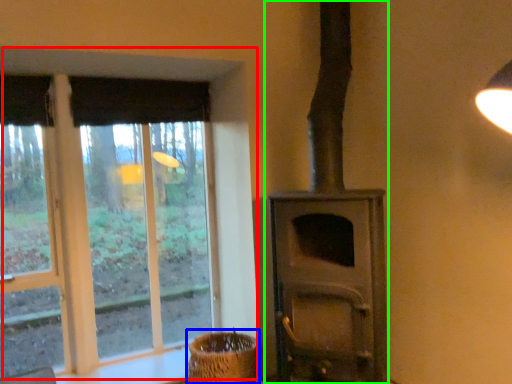
Question: Which is farther away from window (highlighted by a red box)? basket (highlighted by a blue box) or wood burning stove (highlighted by a green box)?

Choices:
 (A) basket
 (B) wood burning stove

Answer: (B)